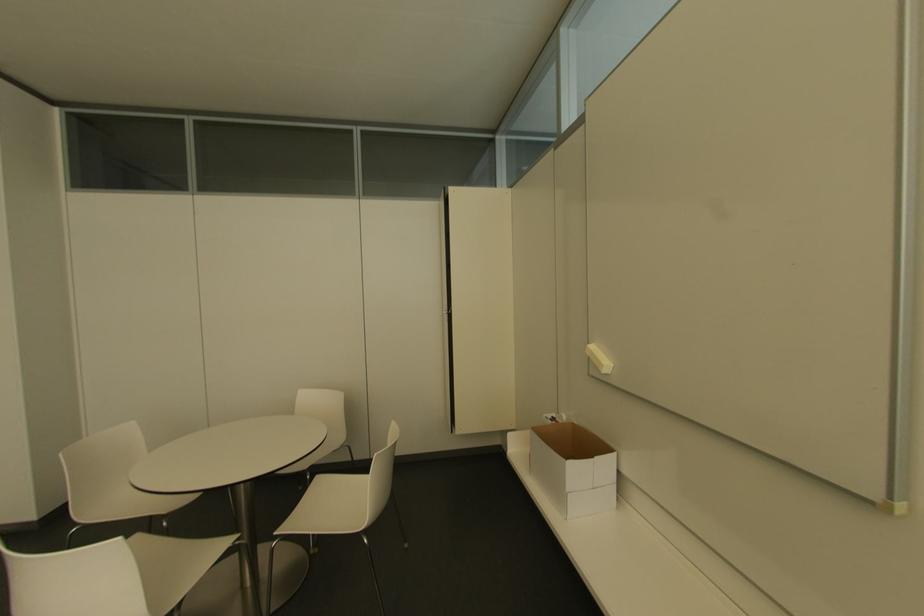
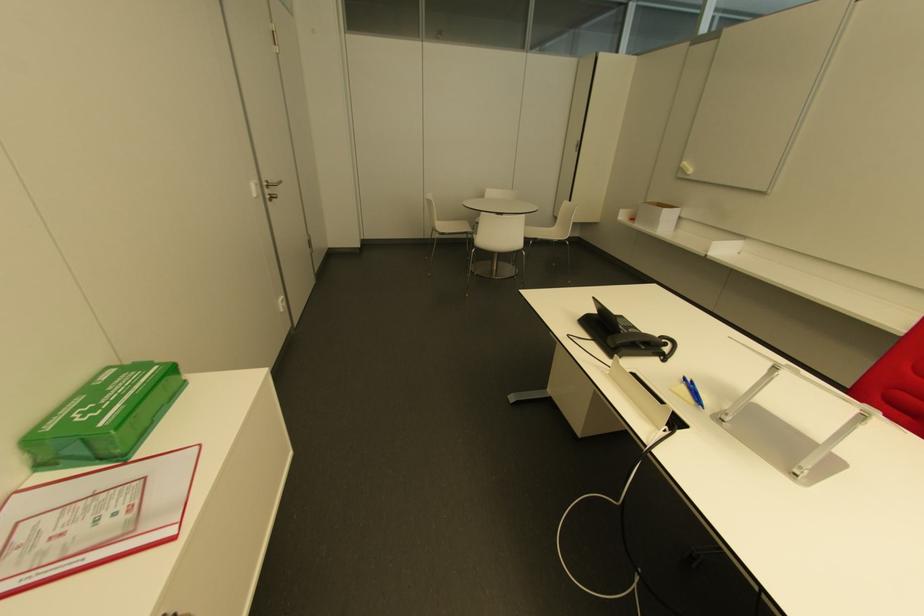
What movement of the cameraman would produce the second image?

The movement direction of the cameraman is left, backward.